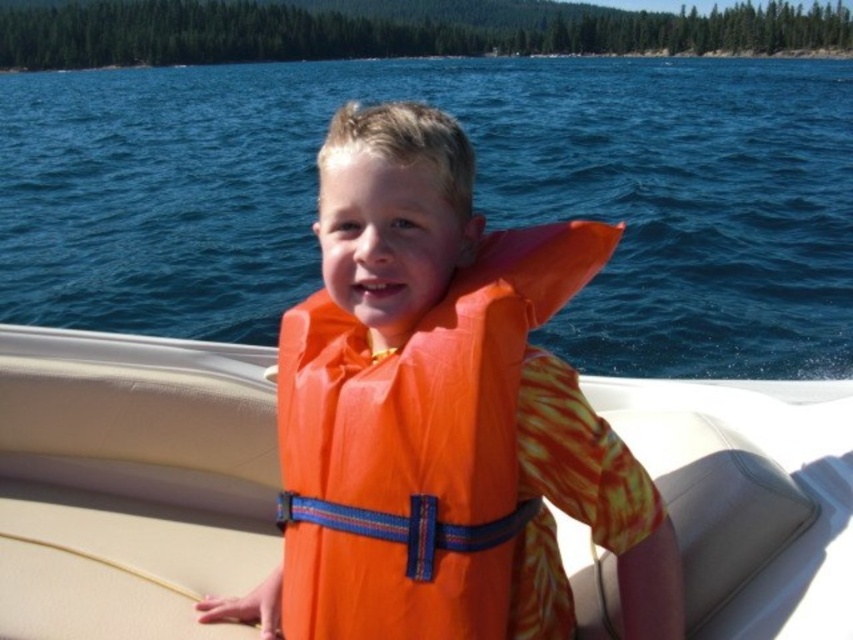
Question: Does orange life vest at center appear on the right side of orange fabric life vest at center?

Choices:
 (A) yes
 (B) no

Answer: (A)

Question: From the image, what is the correct spatial relationship of orange life vest at center in relation to orange rubber life vest at center?

Choices:
 (A) right
 (B) left

Answer: (A)

Question: Which point is farther to the camera?

Choices:
 (A) (241, 120)
 (B) (410, 330)
 (C) (566, 548)

Answer: (A)

Question: Which of the following is the closest to the observer?

Choices:
 (A) orange fabric life vest at center
 (B) orange rubber life vest at center
 (C) orange life vest at center

Answer: (B)

Question: Is orange life vest at center bigger than orange rubber life vest at center?

Choices:
 (A) yes
 (B) no

Answer: (A)

Question: Considering the real-world distances, which object is farthest from the orange fabric life vest at center?

Choices:
 (A) orange life vest at center
 (B) orange rubber life vest at center

Answer: (A)